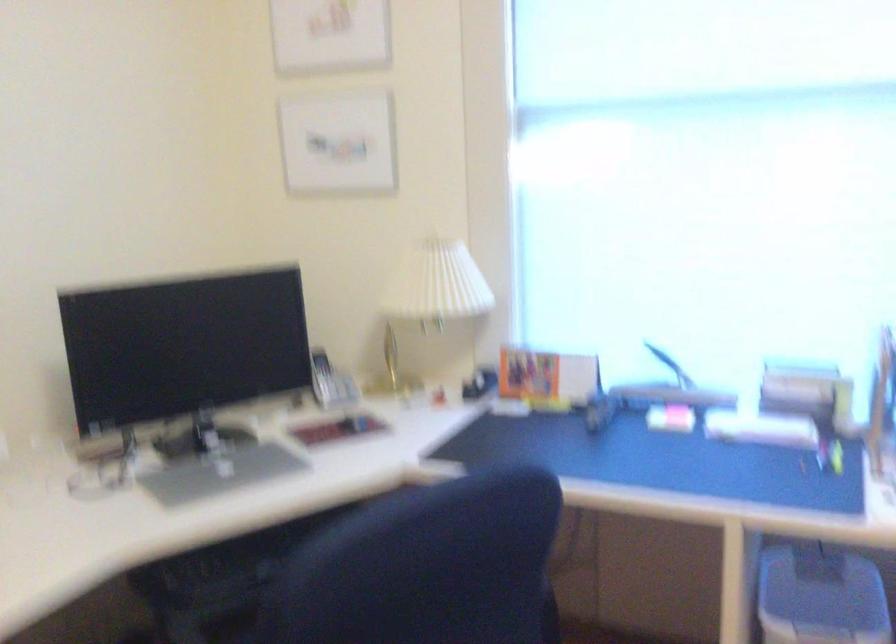
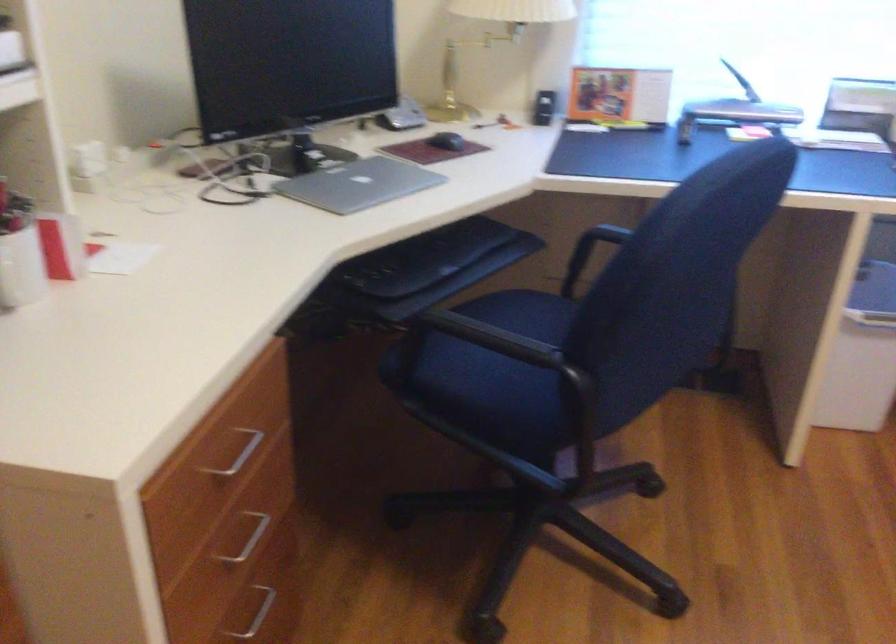
Find the pixel in the second image that matches [213,478] in the first image.

(358, 184)